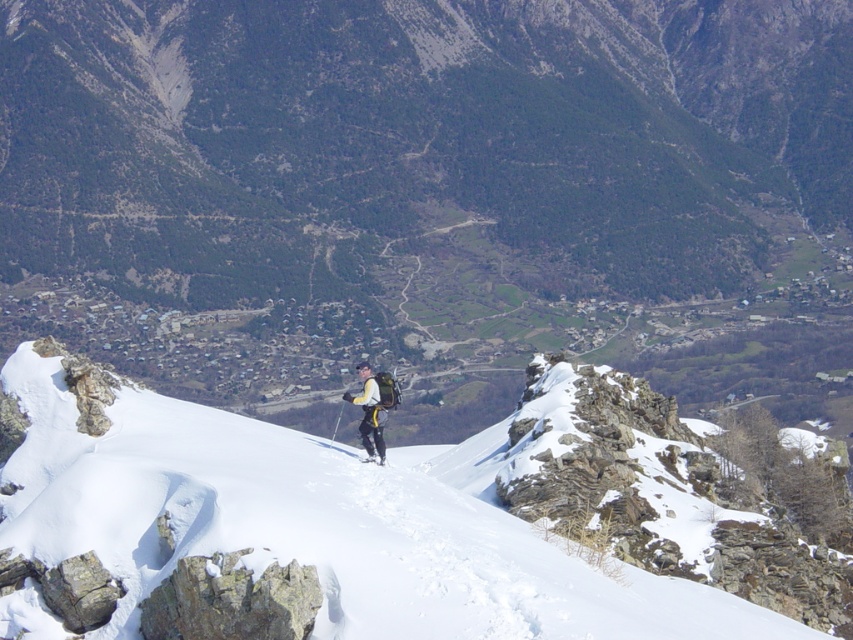
Question: Which of the following is the closest to the observer?

Choices:
 (A) (366, 440)
 (B) (724, 579)

Answer: (B)

Question: Is white powdery snow at center bigger than white fabric jacket at center?

Choices:
 (A) yes
 (B) no

Answer: (A)

Question: Does white powdery snow at center have a larger size compared to white fabric jacket at center?

Choices:
 (A) no
 (B) yes

Answer: (B)

Question: Can you confirm if white powdery snow at center is smaller than white fabric jacket at center?

Choices:
 (A) yes
 (B) no

Answer: (B)

Question: Among these points, which one is farthest from the camera?

Choices:
 (A) (496, 612)
 (B) (380, 390)

Answer: (B)